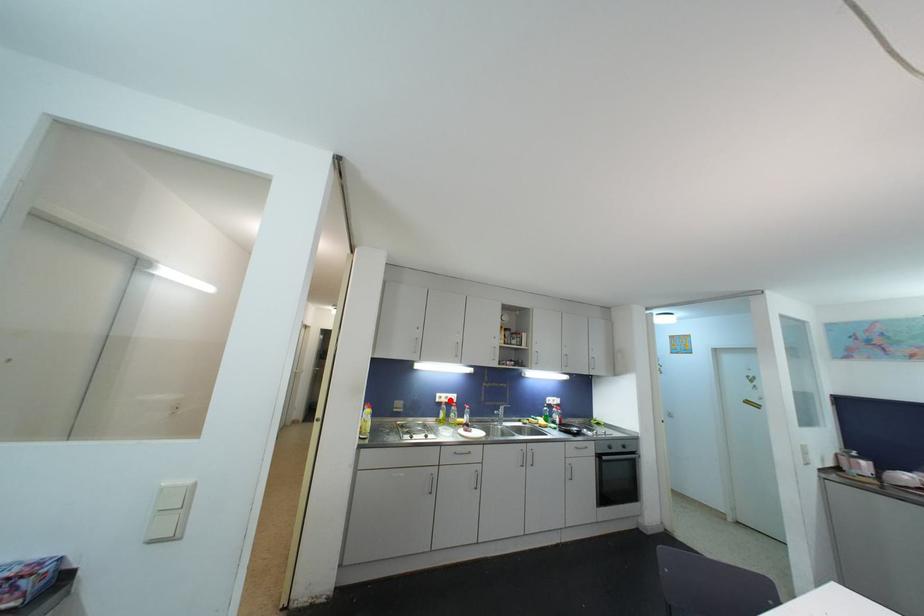
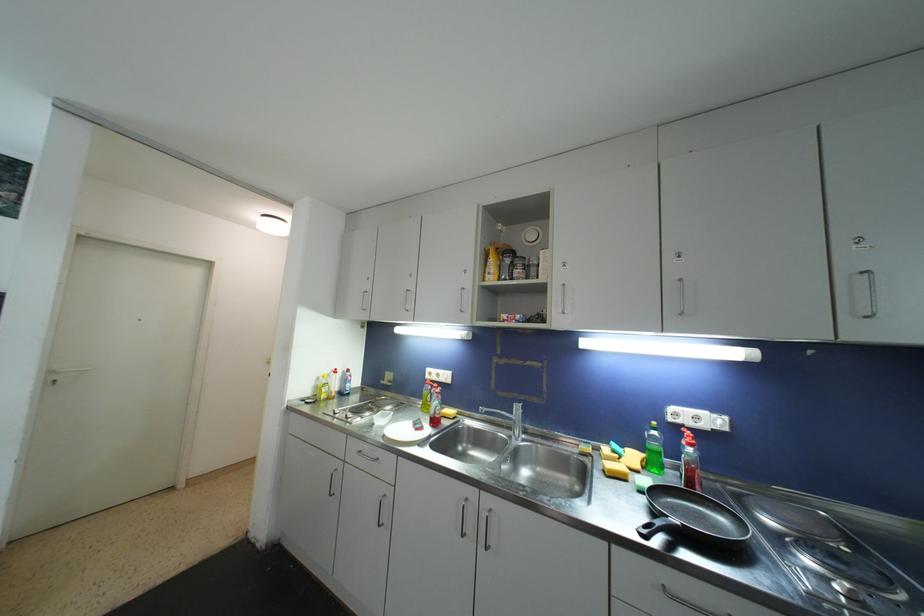
Question: A red point is marked in image1. In image2, is the corresponding 3D point closer to the camera or farther? Reply with the corresponding letter.

Choices:
 (A) The corresponding 3D point is closer.
 (B) The corresponding 3D point is farther.

Answer: (A)